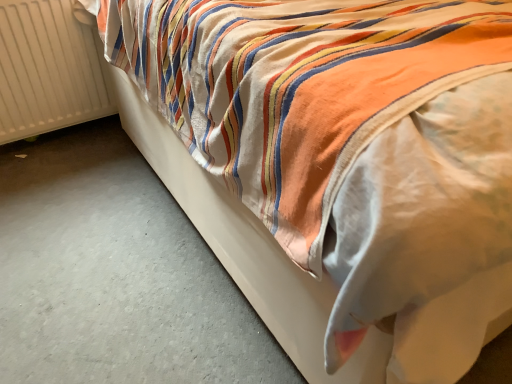
Locate an element on the screen. Image resolution: width=512 pixels, height=384 pixels. vacant space underneath white ribbed radiator at left (from a real-world perspective) is located at coordinates (52, 137).